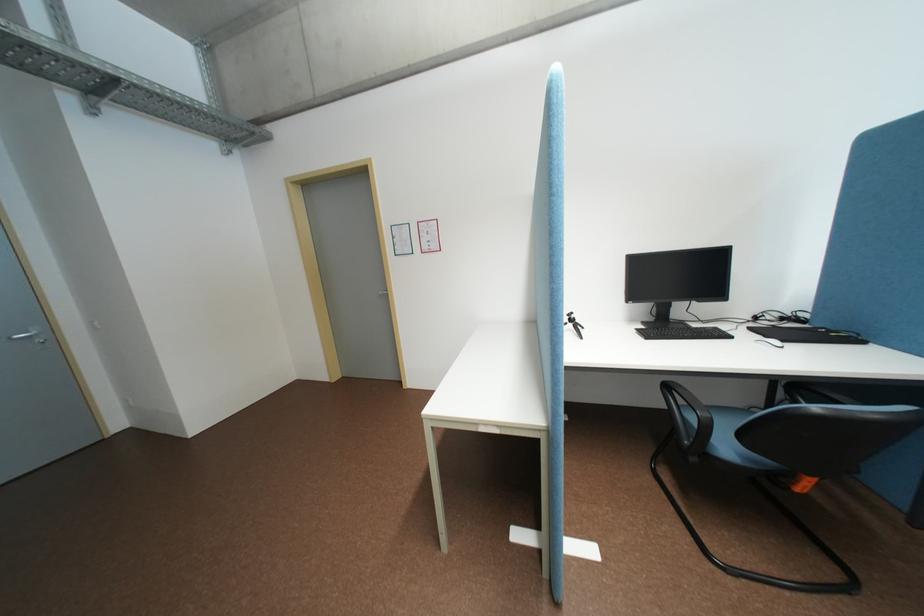
Find the location of `small black tripod`. small black tripod is located at coordinates (574, 323).